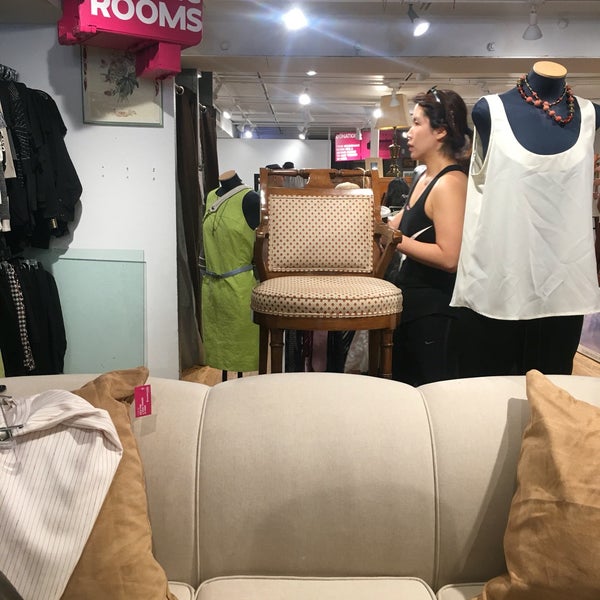
You are a GUI agent. You are given a task and a screenshot of the screen. Output one action in this format:
    pyautogui.click(x=<x>, y=<y>)
    Task: Click on the pillows
    The height and width of the screenshot is (600, 600).
    Given the screenshot: What is the action you would take?
    pyautogui.click(x=566, y=505), pyautogui.click(x=116, y=550)